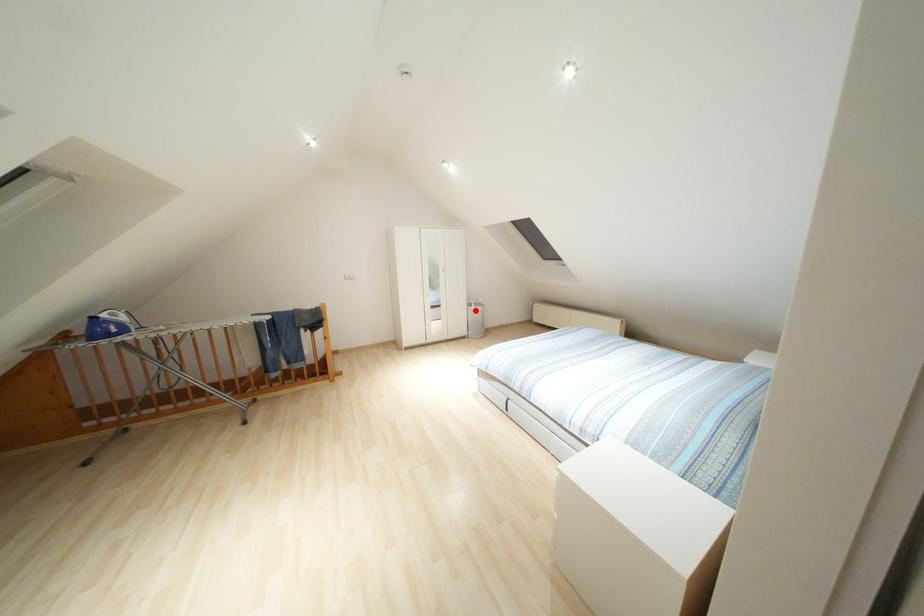
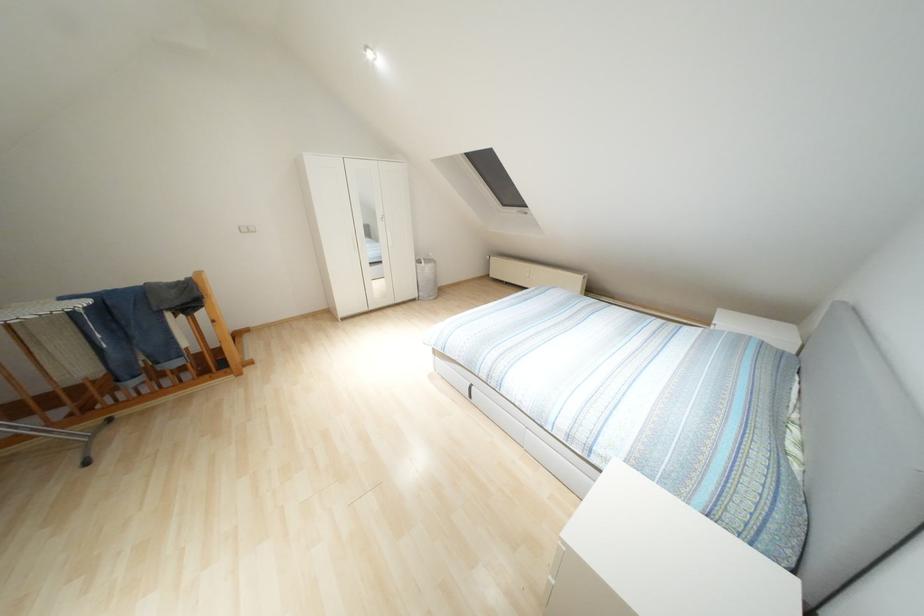
In the second image, find the point that corresponds to the highlighted location in the first image.

(426, 268)